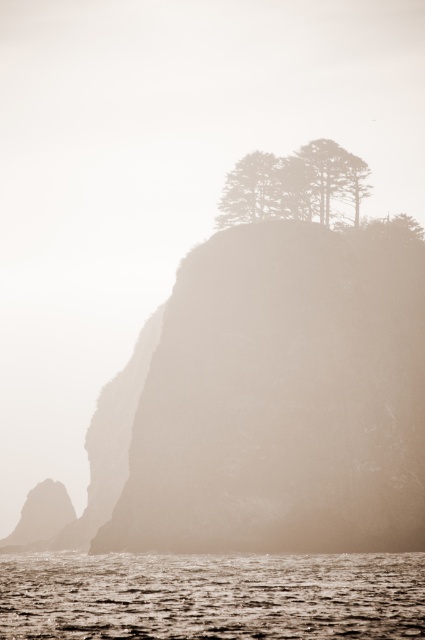
You are a geologist studying the cliff formations in this coastal area. You have a drone with a camera that can capture high resolution images of the cliff. You want to ensure the drone flies directly over the smooth beige cliff at center to capture its unique erosion patterns. Given the coordinates provided, where should the drone be directed to focus its camera?

The drone should focus its camera at the coordinates point [283,397] where the smooth beige cliff at center is located to capture its unique erosion patterns.